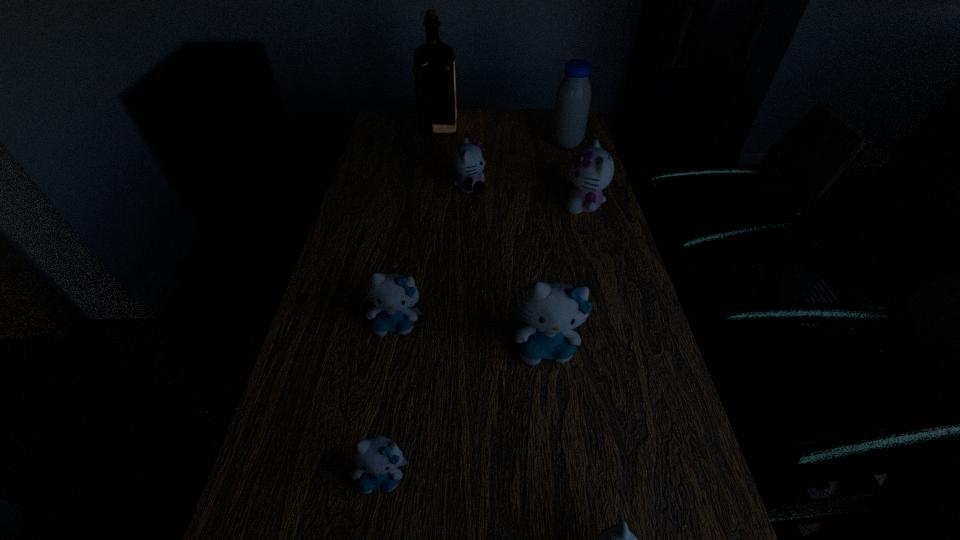
Point out which white kitten is positioned as the nearest to the tallest object. Please provide its 2D coordinates. Your answer should be formatted as a tuple, i.e. [(x, y)], where the tuple contains the x and y coordinates of a point satisfying the conditions above.

[(467, 159)]

Choose which blue kitten is the second nearest neighbor to the second biggest blue kitten. Please provide its 2D coordinates. Your answer should be formatted as a tuple, i.e. [(x, y)], where the tuple contains the x and y coordinates of a point satisfying the conditions above.

[(377, 459)]

Find the location of `the closest blue kitten to the liquor`. the closest blue kitten to the liquor is located at coordinates (393, 295).

The height and width of the screenshot is (540, 960). I want to click on free location that satisfies the following two spatial constraints: 1. on the label of the liquor; 2. on the face of the second biggest blue kitten, so click(x=412, y=323).

I want to click on blank space that satisfies the following two spatial constraints: 1. on the front-facing side of the second smallest white kitten; 2. on the face of the nearest blue kitten, so click(462, 475).